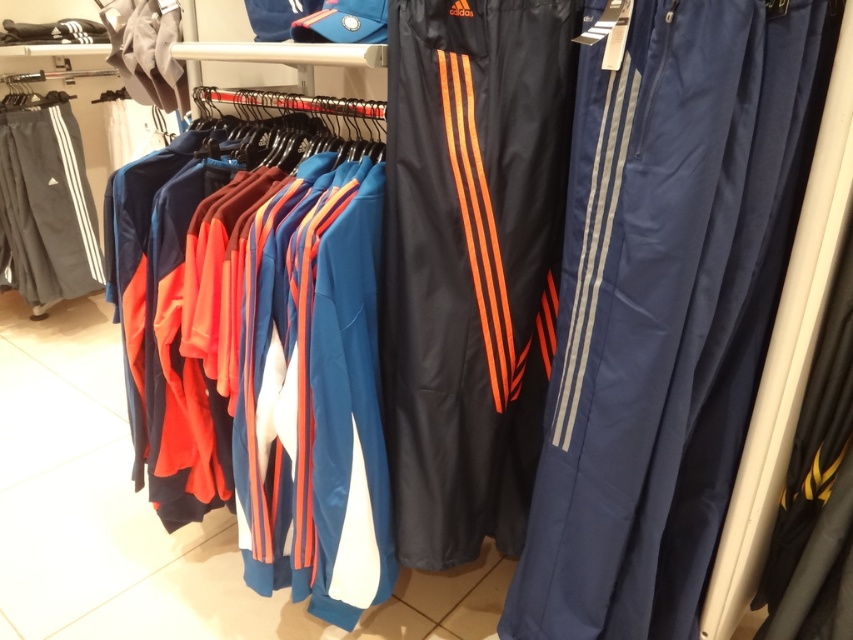
Who is more forward, (437, 364) or (151, 60)?

Positioned in front is point (437, 364).

In the scene shown: Is black synthetic track pants at center positioned behind matte gray hoodie at upper left?

No, it is not.

Is point (518, 48) positioned after point (180, 64)?

That is False.

This screenshot has width=853, height=640. I want to click on black synthetic track pants at center, so click(469, 262).

Who is positioned more to the right, navy blue track pants at center or matte gray hoodie at upper left?

navy blue track pants at center

What do you see at coordinates (665, 307) in the screenshot? The image size is (853, 640). I see `navy blue track pants at center` at bounding box center [665, 307].

The width and height of the screenshot is (853, 640). I want to click on navy blue track pants at center, so click(x=665, y=307).

Can you confirm if navy blue track pants at center is wider than gray cotton track pants at left?

Incorrect, navy blue track pants at center's width does not surpass gray cotton track pants at left's.

Can you confirm if navy blue track pants at center is positioned to the left of gray cotton track pants at left?

Incorrect, navy blue track pants at center is not on the left side of gray cotton track pants at left.

Identify the location of navy blue track pants at center. The width and height of the screenshot is (853, 640). (x=665, y=307).

This screenshot has height=640, width=853. In order to click on navy blue track pants at center in this screenshot , I will do `click(665, 307)`.